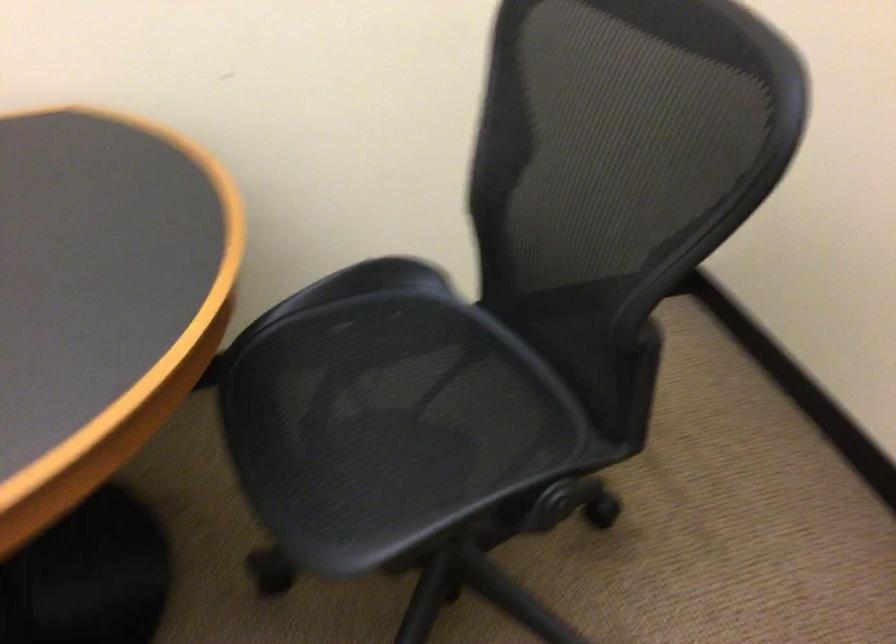
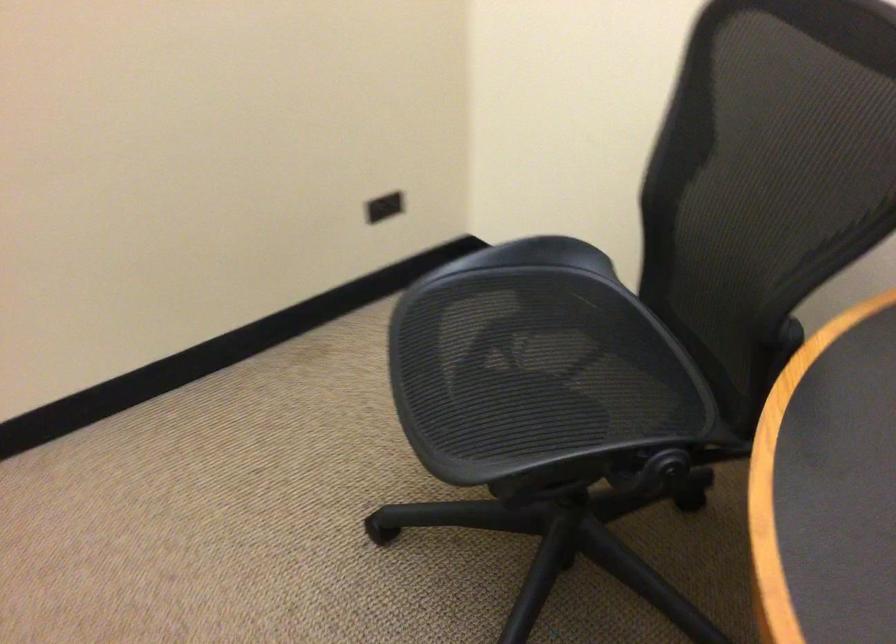
The first image is from the beginning of the video and the second image is from the end. How did the camera likely rotate when shooting the video?

The rotation direction of the camera is left-down.